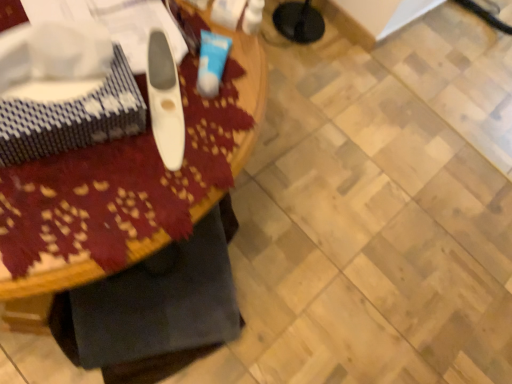
Locate an element on the screen. The width and height of the screenshot is (512, 384). wooden table at center is located at coordinates (128, 185).

What do you see at coordinates (128, 185) in the screenshot? This screenshot has height=384, width=512. I see `wooden table at center` at bounding box center [128, 185].

You are a GUI agent. You are given a task and a screenshot of the screen. Output one action in this format:
    pyautogui.click(x=<x>, y=<y>)
    Task: Click on the wooden table at center
    The height and width of the screenshot is (384, 512).
    Given the screenshot: What is the action you would take?
    pyautogui.click(x=128, y=185)